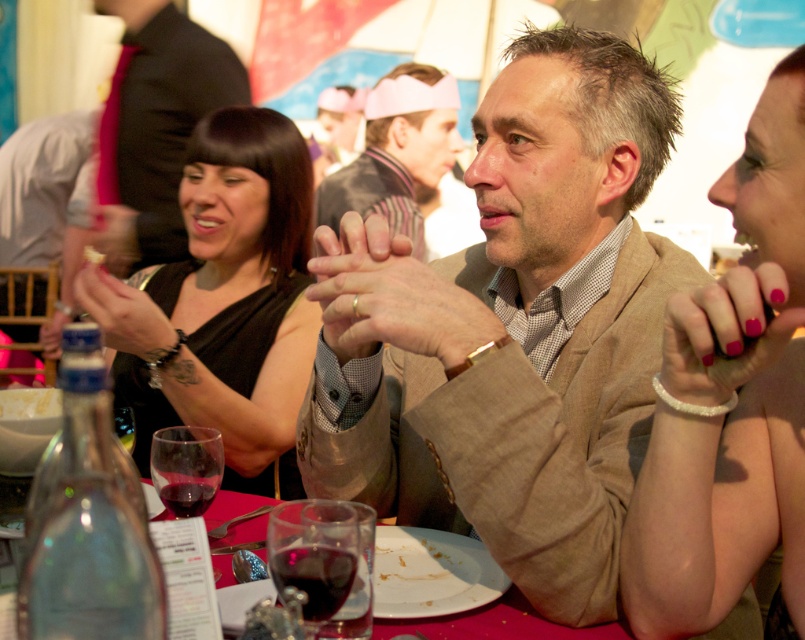
You are a photographer at the event and want to capture a photo of the tan textured blazer at center and the clear glass bottle at lower left. Which object should you focus on first if you want to include both in the frame without moving the camera?

You should focus on the tan textured blazer at center first because it is positioned on the right side of the clear glass bottle at lower left, meaning it is further to the right and closer to the camera. By focusing on it first, you can ensure both objects are within the frame without needing to adjust the camera position.

You are a photographer at the event and want to capture a closeup of the white beaded bracelet at upper right without the translucent glass wine at table center blocking it. How should you adjust your camera angle?

The white beaded bracelet at upper right is in front of the translucent glass wine at table center, so you can lower your camera angle slightly to position the bracelet in the foreground while the wine glass is angled out of the frame.

You are a photographer trying to capture a closeup shot of the clear glass bottle at lower left without the tan textured blazer at center blocking the view. Is the bottle small enough to fit in the frame while avoiding the blazer?

The tan textured blazer at center is larger in size than the clear glass bottle at lower left. Since the bottle is smaller, it might be possible to position the camera so that the blazer doesn not obstruct the view, but this depends on their exact positions and the camera angle.